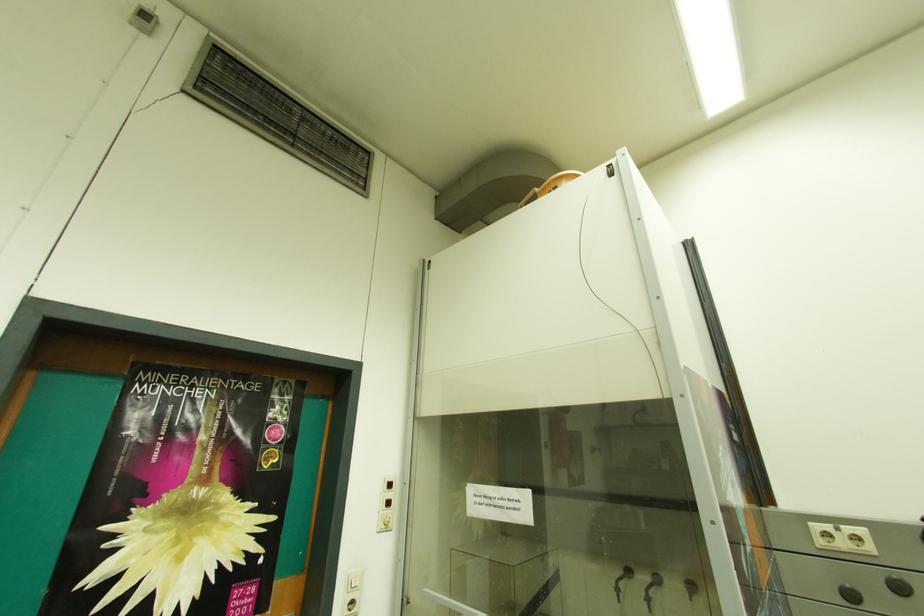
Find where to push the white wall button. Please return your answer as a coordinate pair (x, y).

(824, 536)